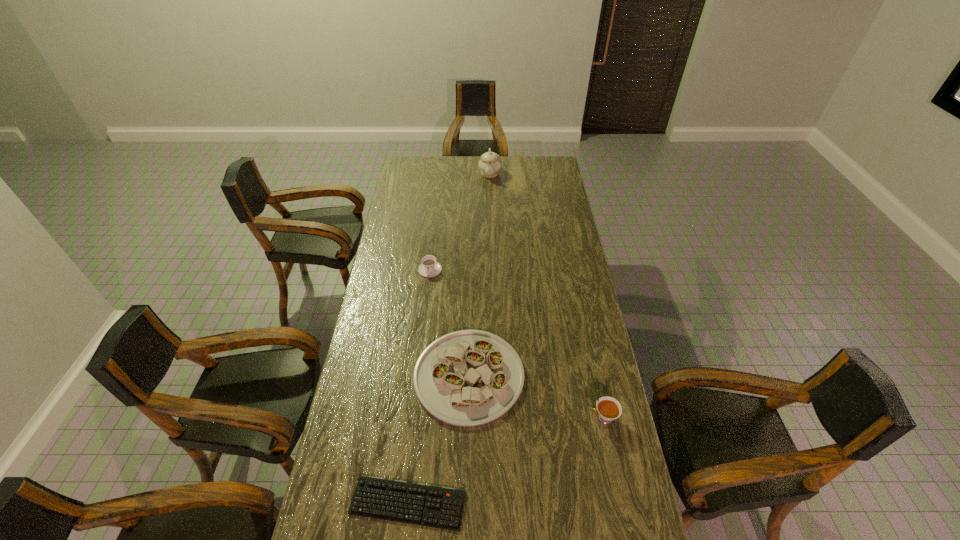
Select which object is the third closest to the shorter teacup. Please provide its 2D coordinates. Your answer should be formatted as a tuple, i.e. [(x, y)], where the tuple contains the x and y coordinates of a point satisfying the conditions above.

[(608, 408)]

You are a GUI agent. You are given a task and a screenshot of the screen. Output one action in this format:
    pyautogui.click(x=<x>, y=<y>)
    Task: Click on the vacant space that satisfies the following two spatial constraints: 1. on the handle side of the platter; 2. on the right side of the farther teacup
    
    Given the screenshot: What is the action you would take?
    pyautogui.click(x=418, y=376)

Find the location of a particular element. This screenshot has height=540, width=960. free region that satisfies the following two spatial constraints: 1. on the back side of the platter; 2. on the right side of the computer keyboard is located at coordinates (421, 376).